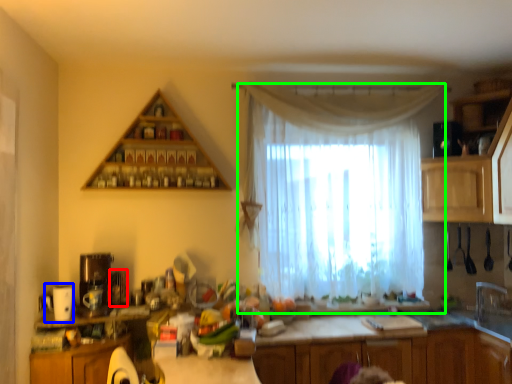
Question: Considering the real-world distances, which object is farthest from appliance (highlighted by a red box)? appliance (highlighted by a blue box) or curtain (highlighted by a green box)?

Choices:
 (A) appliance
 (B) curtain

Answer: (B)